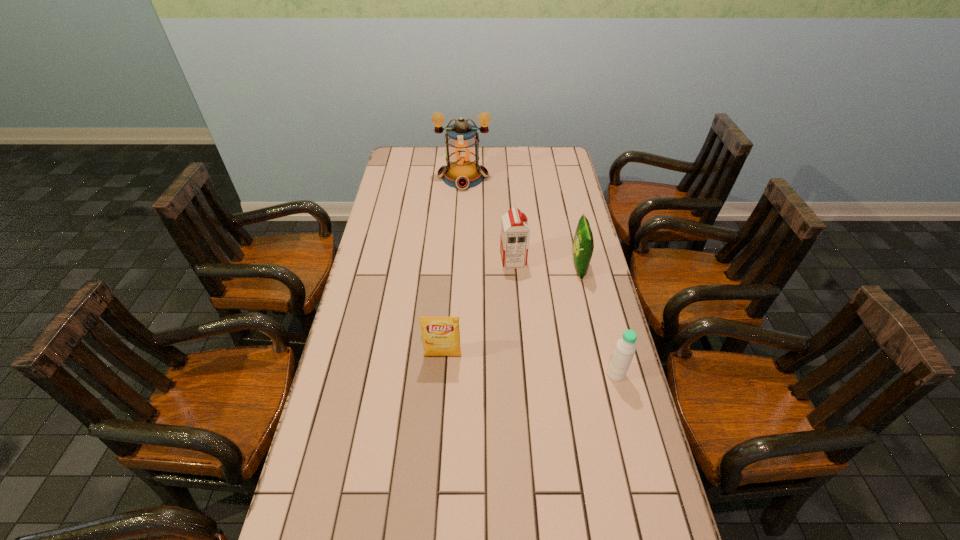
This screenshot has width=960, height=540. In the image, there is a desktop. Find the location of `free space at the far left corner`. free space at the far left corner is located at coordinates (399, 151).

The image size is (960, 540). I want to click on free space at the far right corner of the desktop, so click(563, 166).

This screenshot has width=960, height=540. Find the location of `vacant region between the nearer crisp (potato chip) and the tallest object`. vacant region between the nearer crisp (potato chip) and the tallest object is located at coordinates (453, 267).

I want to click on blank region between the farther crisp (potato chip) and the water bottle, so click(x=597, y=321).

Find the location of a particular element. The image size is (960, 540). vacant area between the left crisp (potato chip) and the lantern is located at coordinates (453, 267).

The image size is (960, 540). Identify the location of unoccupied area between the right crisp (potato chip) and the second nearest object. (511, 312).

Where is `vacant region between the soya milk and the farthest object`? This screenshot has height=540, width=960. vacant region between the soya milk and the farthest object is located at coordinates (488, 219).

I want to click on unoccupied position between the nearer crisp (potato chip) and the right crisp (potato chip), so click(x=511, y=312).

The width and height of the screenshot is (960, 540). Find the location of `free space between the farther crisp (potato chip) and the third object from left to right`. free space between the farther crisp (potato chip) and the third object from left to right is located at coordinates (546, 264).

Image resolution: width=960 pixels, height=540 pixels. I want to click on empty space between the water bottle and the tallest object, so click(540, 276).